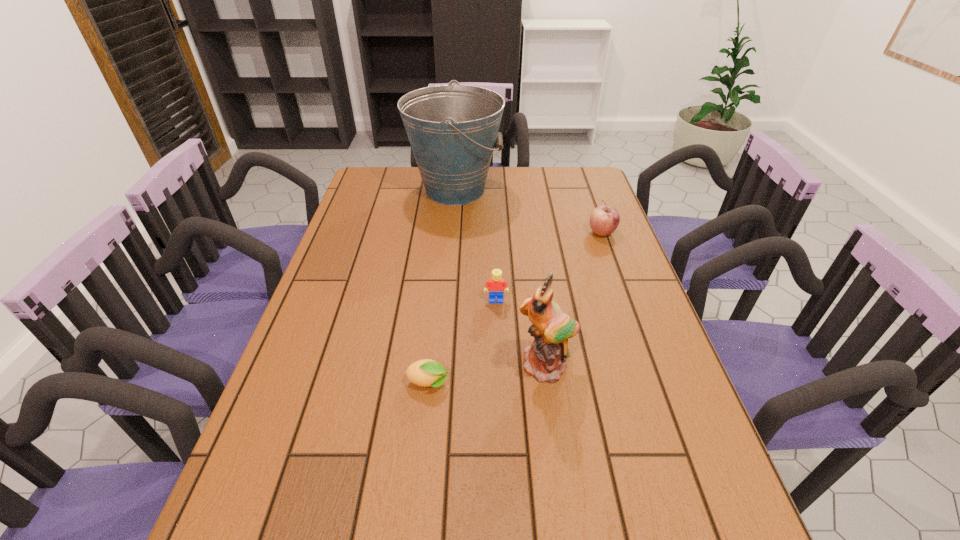
Identify the location of bucket. (453, 129).

What are the coordinates of `parrot` in the screenshot? It's located at (544, 359).

You are a GUI agent. You are given a task and a screenshot of the screen. Output one action in this format:
    pyautogui.click(x=<x>, y=<y>)
    Task: Click on the fourth object from left to right
    The image size is (960, 540).
    Given the screenshot: What is the action you would take?
    pyautogui.click(x=544, y=359)

In order to click on the rightmost object in this screenshot , I will do `click(604, 220)`.

Where is `the fourth nearest object`? The height and width of the screenshot is (540, 960). the fourth nearest object is located at coordinates (604, 220).

What are the coordinates of `Lego` in the screenshot? It's located at (497, 286).

Where is `the shortest object`? the shortest object is located at coordinates point(426,372).

This screenshot has height=540, width=960. I want to click on vacant space located with the handle on opposite sides of the bucket, so click(523, 190).

Find the location of a particular element. Image resolution: width=960 pixels, height=540 pixels. free space located 0.160m on the front-facing side of the second object from right to left is located at coordinates (559, 454).

The width and height of the screenshot is (960, 540). I want to click on vacant region located 0.110m on the front of the rightmost object, so click(612, 263).